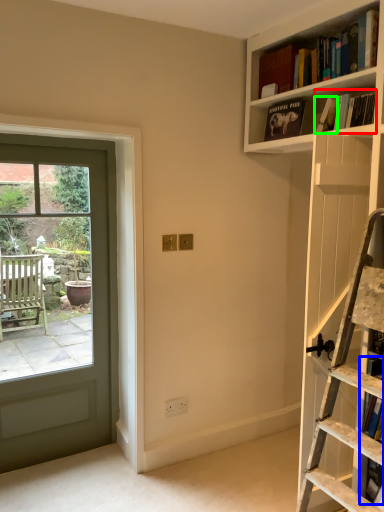
Question: Which object is positioned closest to book (highlighted by a red box)? Select from book (highlighted by a blue box) and book (highlighted by a green box).

Choices:
 (A) book
 (B) book

Answer: (B)